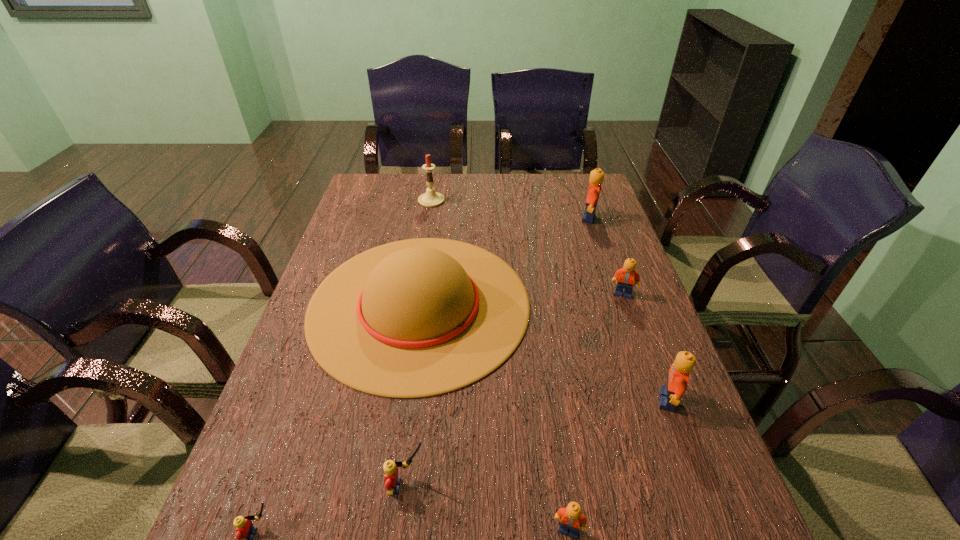
What are the coordinates of `the second farthest object` in the screenshot? It's located at (596, 176).

Where is `the tallest Lego`? The height and width of the screenshot is (540, 960). the tallest Lego is located at coordinates (596, 176).

Locate an element on the screen. red candle is located at coordinates (431, 198).

Where is `the farthest object`? The height and width of the screenshot is (540, 960). the farthest object is located at coordinates coord(431,198).

The height and width of the screenshot is (540, 960). I want to click on sombrero, so click(415, 318).

The image size is (960, 540). In order to click on the second biggest orange Lego in this screenshot , I will do `click(678, 376)`.

Find the location of a particular element. the second tallest Lego is located at coordinates (678, 376).

At what (x,y) coordinates should I click in order to perform the action: click on the fifth nearest Lego. Please return your answer as a coordinate pair (x, y). Looking at the image, I should click on (627, 276).

This screenshot has width=960, height=540. I want to click on the second farthest orange Lego, so (627, 276).

You are a GUI agent. You are given a task and a screenshot of the screen. Output one action in this format:
    pyautogui.click(x=<x>, y=<y>)
    Task: Click on the right yellow Lego
    The image size is (960, 540).
    Given the screenshot: What is the action you would take?
    pyautogui.click(x=392, y=484)